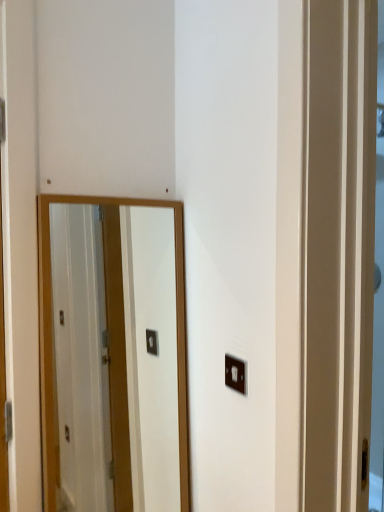
The width and height of the screenshot is (384, 512). I want to click on wooden-framed mirror at center, so click(151, 354).

Based on the photo, in order to face wooden-framed mirror at center, should I rotate leftwards or rightwards?

Turn left approximately 9.241 degrees to face it.

What do you see at coordinates (151, 354) in the screenshot? I see `wooden-framed mirror at center` at bounding box center [151, 354].

The image size is (384, 512). Identify the location of matte black light switch at lower right. (235, 374).

Measure the distance between point (227,385) and camera.

Point (227,385) and camera are 3.62 feet apart from each other.

What do you see at coordinates (235, 374) in the screenshot? I see `matte black light switch at lower right` at bounding box center [235, 374].

At what (x,y) coordinates should I click in order to perform the action: click on wooden-framed mirror at center. Please return your answer as a coordinate pair (x, y). The width and height of the screenshot is (384, 512). Looking at the image, I should click on (151, 354).

Can you confirm if wooden-framed mirror at center is positioned to the left of matte black light switch at lower right?

Yes.

Does wooden-framed mirror at center come behind matte black light switch at lower right?

No, wooden-framed mirror at center is in front of matte black light switch at lower right.

Considering the positions of points (174, 324) and (232, 388), is point (174, 324) farther from camera compared to point (232, 388)?

Yes, point (174, 324) is behind point (232, 388).

From the image's perspective, relative to matte black light switch at lower right, is wooden-framed mirror at center above or below?

From the image's perspective, wooden-framed mirror at center appears below matte black light switch at lower right.

From a real-world perspective, does wooden-framed mirror at center sit lower than matte black light switch at lower right?

Correct, in the physical world, wooden-framed mirror at center is lower than matte black light switch at lower right.

Does wooden-framed mirror at center have a lesser width compared to matte black light switch at lower right?

In fact, wooden-framed mirror at center might be wider than matte black light switch at lower right.

Considering the sizes of objects wooden-framed mirror at center and matte black light switch at lower right in the image provided, who is taller, wooden-framed mirror at center or matte black light switch at lower right?

wooden-framed mirror at center.

Who is bigger, wooden-framed mirror at center or matte black light switch at lower right?

Bigger between the two is wooden-framed mirror at center.

Do you think wooden-framed mirror at center is within matte black light switch at lower right, or outside of it?

wooden-framed mirror at center cannot be found inside matte black light switch at lower right.

Is wooden-framed mirror at center directly adjacent to matte black light switch at lower right?

wooden-framed mirror at center and matte black light switch at lower right are not in contact.

Is wooden-framed mirror at center oriented towards matte black light switch at lower right?

Yes, wooden-framed mirror at center is turned towards matte black light switch at lower right.

Measure the distance between wooden-framed mirror at center and matte black light switch at lower right.

50.46 centimeters.

Where is `mirror below the matte black light switch at lower right (from a real-world perspective)`? Image resolution: width=384 pixels, height=512 pixels. mirror below the matte black light switch at lower right (from a real-world perspective) is located at coordinates (151, 354).

Between matte black light switch at lower right and wooden-framed mirror at center, which one appears on the left side from the viewer's perspective?

Positioned to the left is wooden-framed mirror at center.

Between matte black light switch at lower right and wooden-framed mirror at center, which one is positioned in front?

wooden-framed mirror at center is in front.

Between point (228, 386) and point (148, 365), which one is positioned behind?

The point (148, 365) is behind.

From the image's perspective, which one is positioned lower, matte black light switch at lower right or wooden-framed mirror at center?

wooden-framed mirror at center, from the image's perspective.

From a real-world perspective, is matte black light switch at lower right above or below wooden-framed mirror at center?

matte black light switch at lower right is situated higher than wooden-framed mirror at center in the real world.

In terms of width, does matte black light switch at lower right look wider or thinner when compared to wooden-framed mirror at center?

matte black light switch at lower right is thinner than wooden-framed mirror at center.

Based on the photo, which of these two, matte black light switch at lower right or wooden-framed mirror at center, stands shorter?

With less height is matte black light switch at lower right.

Considering the sizes of objects matte black light switch at lower right and wooden-framed mirror at center in the image provided, who is bigger, matte black light switch at lower right or wooden-framed mirror at center?

wooden-framed mirror at center.

Is matte black light switch at lower right completely or partially outside of wooden-framed mirror at center?

Indeed, matte black light switch at lower right is completely outside wooden-framed mirror at center.

Is matte black light switch at lower right in contact with wooden-framed mirror at center?

No, matte black light switch at lower right is not next to wooden-framed mirror at center.

Could you tell me if matte black light switch at lower right is facing wooden-framed mirror at center?

No, matte black light switch at lower right is not facing towards wooden-framed mirror at center.

The width and height of the screenshot is (384, 512). Find the location of `light switch that is above the wooden-framed mirror at center (from a real-world perspective)`. light switch that is above the wooden-framed mirror at center (from a real-world perspective) is located at coordinates (235, 374).

In the image, there is a matte black light switch at lower right. Identify the location of mirror below it (from the image's perspective). (151, 354).

Find the location of a particular element. light switch above the wooden-framed mirror at center (from a real-world perspective) is located at coordinates 235,374.